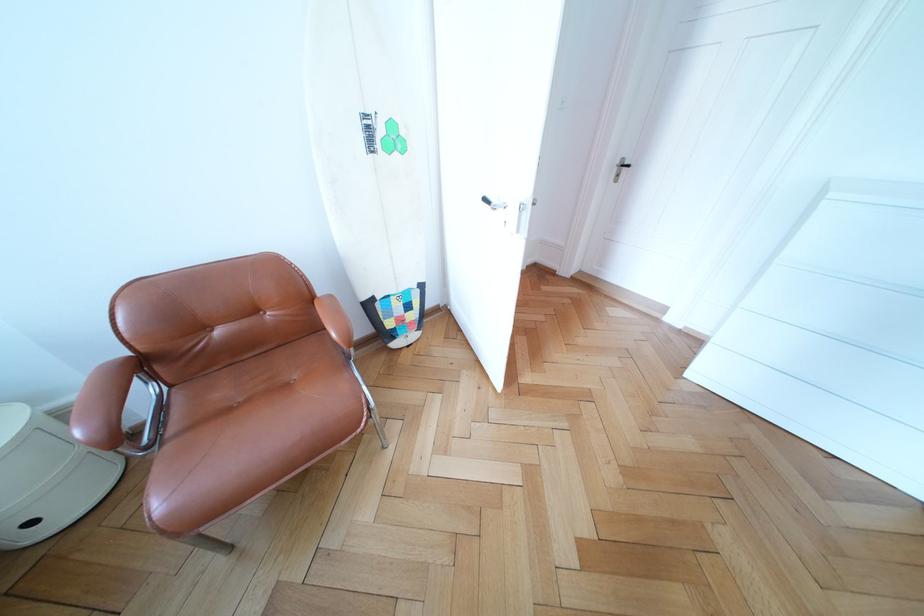
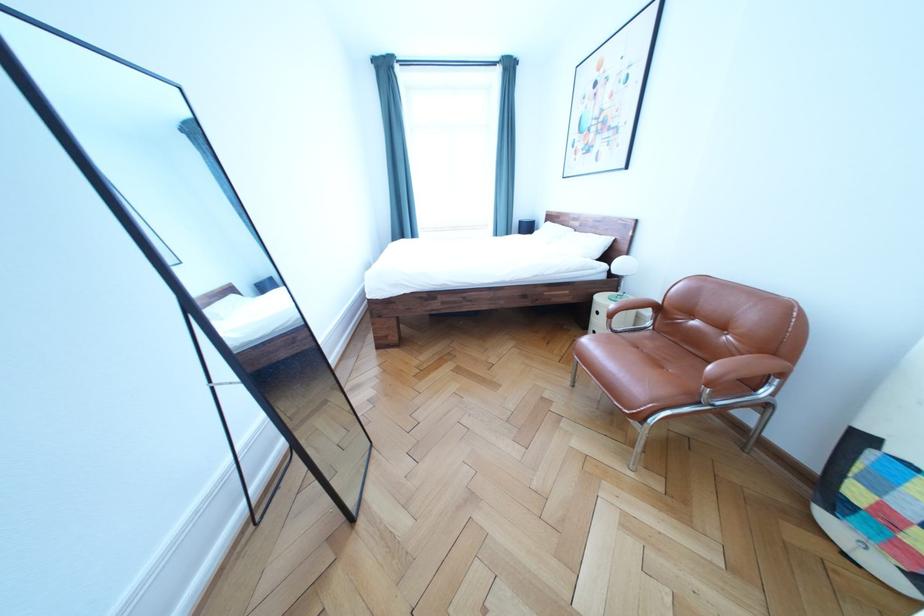
In the second image, find the point that corresponds to point (298, 323) in the first image.

(744, 355)